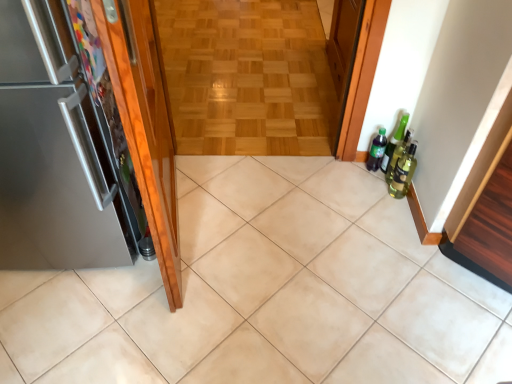
The image size is (512, 384). I want to click on vacant area that lies in front of shiny wood door at left, the second door from the left, so (x=172, y=318).